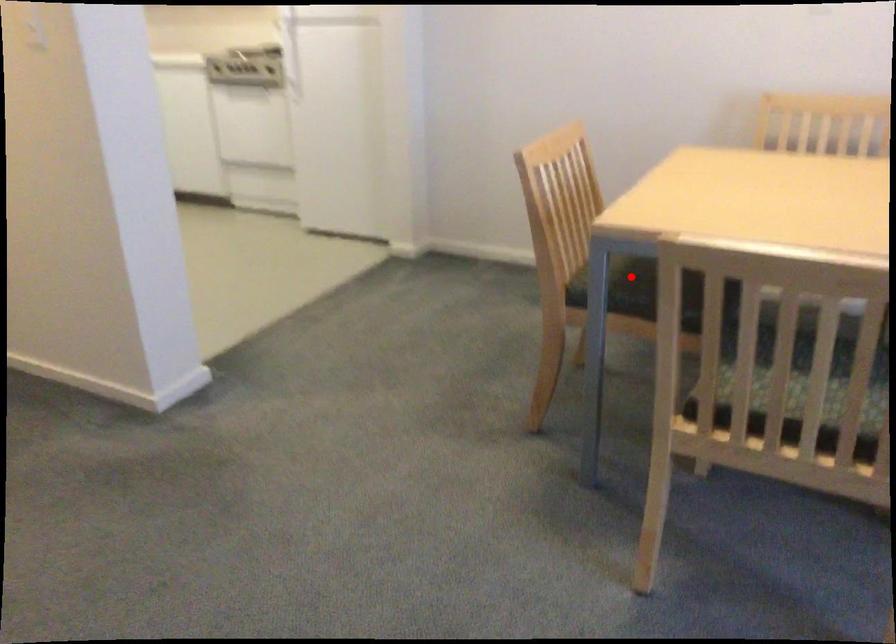
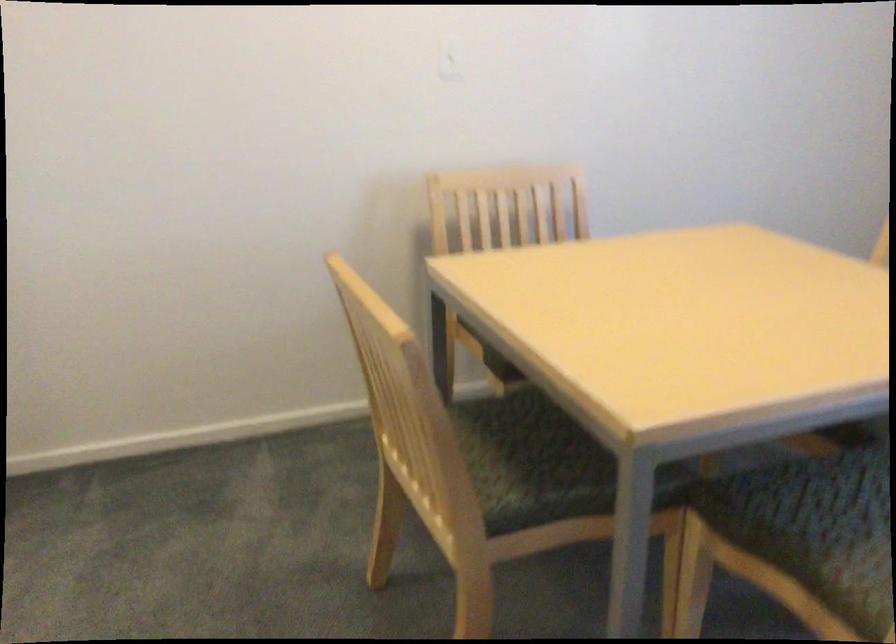
Question: I am providing you with two images of the same scene from different viewpoints. A red point is shown in image1. For the corresponding object point in image2, is it positioned nearer or farther from the camera?

Choices:
 (A) Nearer
 (B) Farther

Answer: (A)